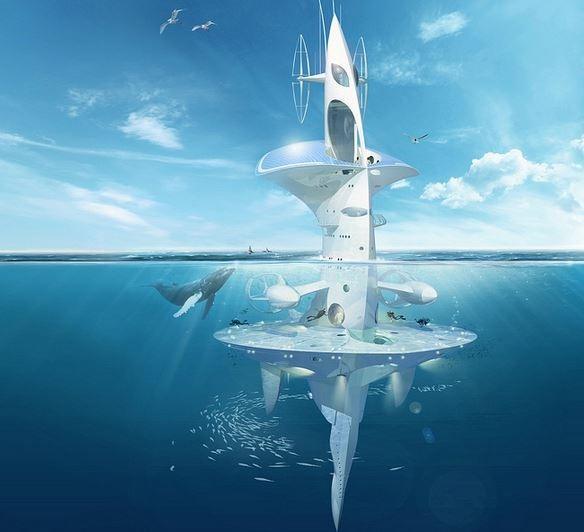
You are a GUI agent. You are given a task and a screenshot of the screen. Output one action in this format:
    pyautogui.click(x=<x>, y=<y>)
    Task: Click on the windows
    
    Given the screenshot: What is the action you would take?
    pyautogui.click(x=339, y=74), pyautogui.click(x=347, y=126), pyautogui.click(x=354, y=212), pyautogui.click(x=333, y=310), pyautogui.click(x=388, y=337), pyautogui.click(x=346, y=284), pyautogui.click(x=357, y=72)